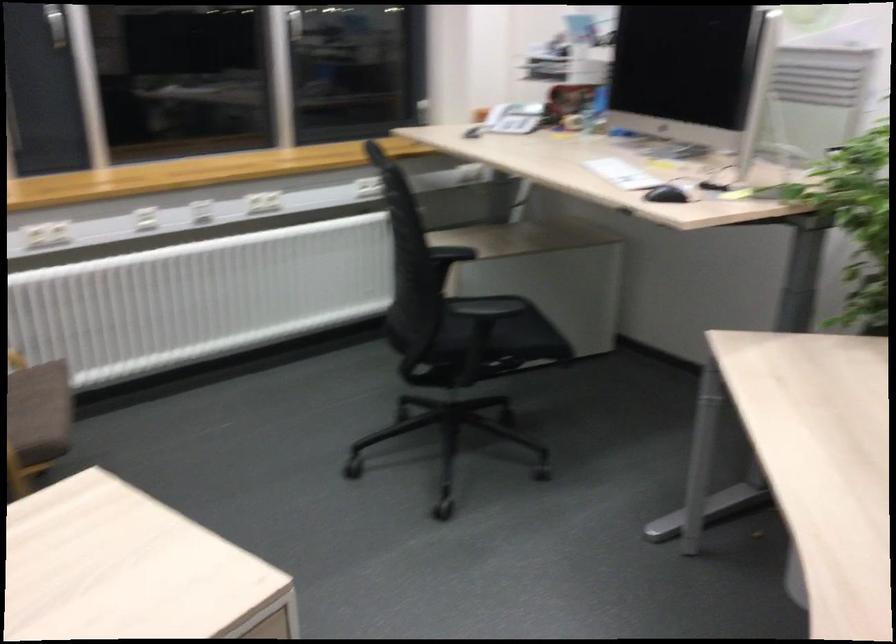
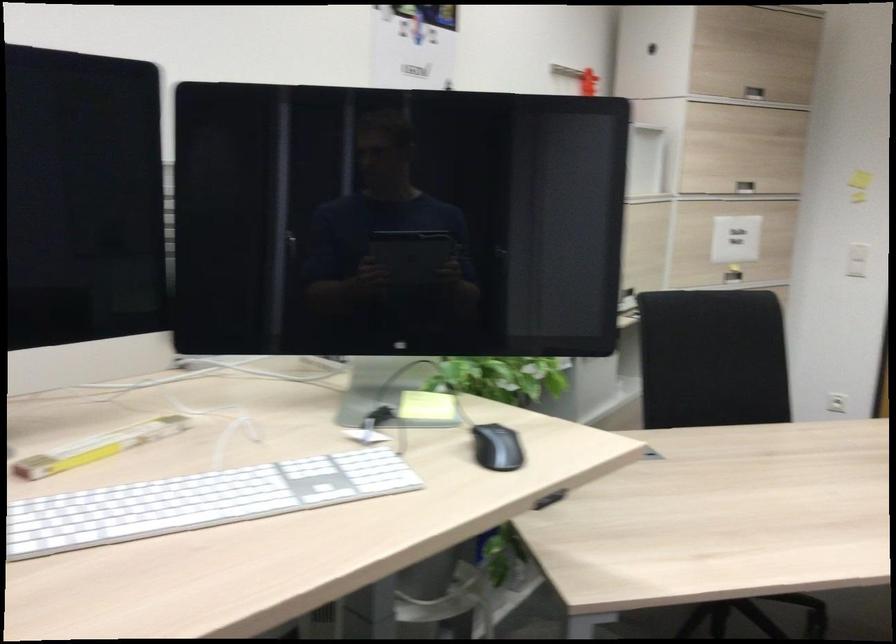
In the second image, find the point that corresponds to point 673,193 in the first image.

(496, 448)